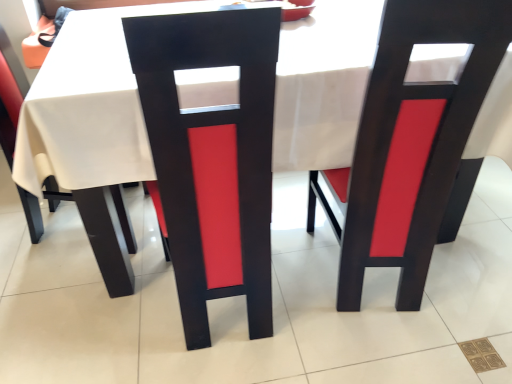
Locate an element on the screen. Image resolution: width=512 pixels, height=384 pixels. matte black chair at left, the third chair viewed from the right is located at coordinates (9, 102).

The image size is (512, 384). Describe the element at coordinates (9, 102) in the screenshot. I see `matte black chair at left, placed as the 1th chair when sorted from left to right` at that location.

What do you see at coordinates (212, 157) in the screenshot? The image size is (512, 384). I see `matte black chair at center, positioned as the 2th chair in left-to-right order` at bounding box center [212, 157].

Where is `matte black chair at center, which is the 1th chair in right-to-left order`? This screenshot has height=384, width=512. matte black chair at center, which is the 1th chair in right-to-left order is located at coordinates (410, 143).

Where is `matte black chair at left, the third chair viewed from the right`? This screenshot has width=512, height=384. matte black chair at left, the third chair viewed from the right is located at coordinates (9, 102).

From the image's perspective, who appears lower, matte black chair at center, which is the 1th chair in right-to-left order, or matte black chair at left, the third chair viewed from the right?

matte black chair at center, which is the 1th chair in right-to-left order.

Does matte black chair at center, which is the 3th chair from left to right, lie behind matte black chair at left, placed as the 1th chair when sorted from left to right?

No, matte black chair at center, which is the 3th chair from left to right, is in front of matte black chair at left, placed as the 1th chair when sorted from left to right.

Is matte black chair at center, which is the 3th chair from left to right, positioned with its back to matte black chair at left, the third chair viewed from the right?

That's not correct — matte black chair at center, which is the 3th chair from left to right, is not looking away from matte black chair at left, the third chair viewed from the right.

Is matte black chair at center, which is the 1th chair in right-to-left order, taller than matte black chair at left, placed as the 1th chair when sorted from left to right?

Correct, matte black chair at center, which is the 1th chair in right-to-left order, is much taller as matte black chair at left, placed as the 1th chair when sorted from left to right.

From the image's perspective, does matte black chair at left, the third chair viewed from the right, appear lower than matte black chair at center, acting as the second chair starting from the right?

No, from the image's perspective, matte black chair at left, the third chair viewed from the right, is not below matte black chair at center, acting as the second chair starting from the right.

Between matte black chair at left, placed as the 1th chair when sorted from left to right, and matte black chair at center, positioned as the 2th chair in left-to-right order, which one is positioned in front?

matte black chair at center, positioned as the 2th chair in left-to-right order, is in front.

Are matte black chair at left, the third chair viewed from the right, and matte black chair at center, positioned as the 2th chair in left-to-right order, making contact?

They are not placed beside each other.

Can you confirm if matte black chair at left, the third chair viewed from the right, is thinner than matte black chair at center, positioned as the 2th chair in left-to-right order?

In fact, matte black chair at left, the third chair viewed from the right, might be wider than matte black chair at center, positioned as the 2th chair in left-to-right order.

Looking at this image, considering the sizes of matte black chair at left, the third chair viewed from the right, and matte black chair at center, which is the 3th chair from left to right, in the image, is matte black chair at left, the third chair viewed from the right, taller or shorter than matte black chair at center, which is the 3th chair from left to right,?

matte black chair at left, the third chair viewed from the right, is shorter than matte black chair at center, which is the 3th chair from left to right.

Looking at this image, can you tell me how much matte black chair at left, the third chair viewed from the right, and matte black chair at center, which is the 3th chair from left to right, differ in facing direction?

matte black chair at left, the third chair viewed from the right, and matte black chair at center, which is the 3th chair from left to right, are facing 88.5 degrees away from each other.

Is matte black chair at left, the third chair viewed from the right, bigger or smaller than matte black chair at center, which is the 1th chair in right-to-left order?

Clearly, matte black chair at left, the third chair viewed from the right, is smaller in size than matte black chair at center, which is the 1th chair in right-to-left order.

Is matte black chair at left, the third chair viewed from the right, closer to the viewer compared to matte black chair at center, which is the 1th chair in right-to-left order?

No, it is not.

Based on the photo, is matte black chair at center, positioned as the 2th chair in left-to-right order, not inside matte black chair at left, the third chair viewed from the right?

Yes, matte black chair at center, positioned as the 2th chair in left-to-right order, is located beyond the bounds of matte black chair at left, the third chair viewed from the right.

Looking at this image, measure the distance between matte black chair at center, acting as the second chair starting from the right, and matte black chair at left, the third chair viewed from the right.

The distance of matte black chair at center, acting as the second chair starting from the right, from matte black chair at left, the third chair viewed from the right, is 90.51 centimeters.

How many degrees apart are the facing directions of matte black chair at center, acting as the second chair starting from the right, and matte black chair at left, the third chair viewed from the right?

The angle between the facing direction of matte black chair at center, acting as the second chair starting from the right, and the facing direction of matte black chair at left, the third chair viewed from the right, is 99.6 degrees.

Does matte black chair at center, positioned as the 2th chair in left-to-right order, lie behind matte black chair at left, the third chair viewed from the right?

No, matte black chair at center, positioned as the 2th chair in left-to-right order, is closer to the viewer.

Is matte black chair at center, acting as the second chair starting from the right, located outside matte black chair at center, which is the 3th chair from left to right?

Yes, matte black chair at center, acting as the second chair starting from the right, is located beyond the bounds of matte black chair at center, which is the 3th chair from left to right.

Is matte black chair at center, positioned as the 2th chair in left-to-right order, bigger or smaller than matte black chair at center, which is the 3th chair from left to right?

Considering their sizes, matte black chair at center, positioned as the 2th chair in left-to-right order, takes up less space than matte black chair at center, which is the 3th chair from left to right.

How many degrees apart are the facing directions of matte black chair at center, acting as the second chair starting from the right, and matte black chair at center, which is the 3th chair from left to right?

11.2 degrees.

This screenshot has width=512, height=384. Find the location of `chair above the matte black chair at center, which is the 3th chair from left to right (from a real-world perspective)`. chair above the matte black chair at center, which is the 3th chair from left to right (from a real-world perspective) is located at coordinates (212, 157).

Is matte black chair at center, which is the 3th chair from left to right, next to matte black chair at center, acting as the second chair starting from the right, and touching it?

No, matte black chair at center, which is the 3th chair from left to right, is not next to matte black chair at center, acting as the second chair starting from the right.

From the image's perspective, between matte black chair at center, which is the 1th chair in right-to-left order, and matte black chair at center, positioned as the 2th chair in left-to-right order, which one is located above?

From the image's view, matte black chair at center, which is the 1th chair in right-to-left order, is above.

Between matte black chair at center, which is the 1th chair in right-to-left order, and matte black chair at center, positioned as the 2th chair in left-to-right order, which one is positioned in front?

Positioned in front is matte black chair at center, positioned as the 2th chair in left-to-right order.

There is a matte black chair at left, the third chair viewed from the right. Identify the location of the 1st chair above it (from a real-world perspective). Image resolution: width=512 pixels, height=384 pixels. (410, 143).

Starting from the matte black chair at left, the third chair viewed from the right, which chair is the 2nd one in front? Please provide its 2D coordinates.

[(212, 157)]

In the scene shown: Looking at the image, which one is located further to matte black chair at left, the third chair viewed from the right, matte black chair at center, which is the 1th chair in right-to-left order, or matte black chair at center, positioned as the 2th chair in left-to-right order?

The object further to matte black chair at left, the third chair viewed from the right, is matte black chair at center, which is the 1th chair in right-to-left order.

Based on their spatial positions, is matte black chair at center, which is the 3th chair from left to right, or matte black chair at left, the third chair viewed from the right, further from matte black chair at center, acting as the second chair starting from the right?

matte black chair at left, the third chair viewed from the right, lies further to matte black chair at center, acting as the second chair starting from the right, than the other object.

Estimate the real-world distances between objects in this image. Which object is closer to matte black chair at center, positioned as the 2th chair in left-to-right order, matte black chair at left, the third chair viewed from the right, or matte black chair at center, which is the 3th chair from left to right?

matte black chair at center, which is the 3th chair from left to right, is positioned closer to the anchor matte black chair at center, positioned as the 2th chair in left-to-right order.

Looking at the image, which one is located further to matte black chair at left, placed as the 1th chair when sorted from left to right, matte black chair at center, positioned as the 2th chair in left-to-right order, or matte black chair at center, which is the 1th chair in right-to-left order?

Among the two, matte black chair at center, which is the 1th chair in right-to-left order, is located further to matte black chair at left, placed as the 1th chair when sorted from left to right.

Estimate the real-world distances between objects in this image. Which object is closer to matte black chair at center, which is the 1th chair in right-to-left order, matte black chair at left, placed as the 1th chair when sorted from left to right, or matte black chair at center, positioned as the 2th chair in left-to-right order?

The object closer to matte black chair at center, which is the 1th chair in right-to-left order, is matte black chair at center, positioned as the 2th chair in left-to-right order.

When comparing their distances from matte black chair at center, which is the 1th chair in right-to-left order, does matte black chair at center, acting as the second chair starting from the right, or matte black chair at left, the third chair viewed from the right, seem closer?

The object closer to matte black chair at center, which is the 1th chair in right-to-left order, is matte black chair at center, acting as the second chair starting from the right.

Locate an element on the screen. This screenshot has height=384, width=512. chair situated between matte black chair at left, the third chair viewed from the right, and matte black chair at center, which is the 3th chair from left to right, from left to right is located at coordinates (212, 157).